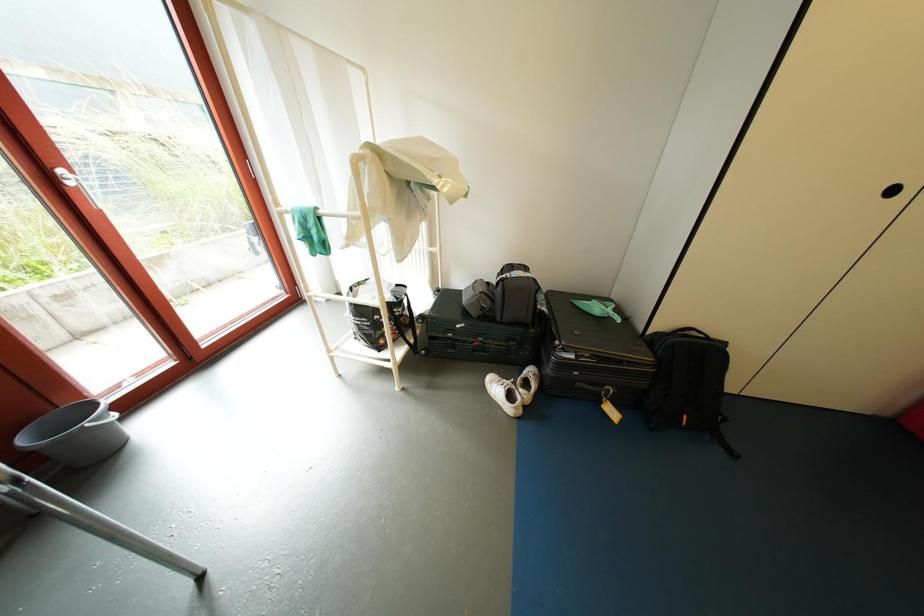
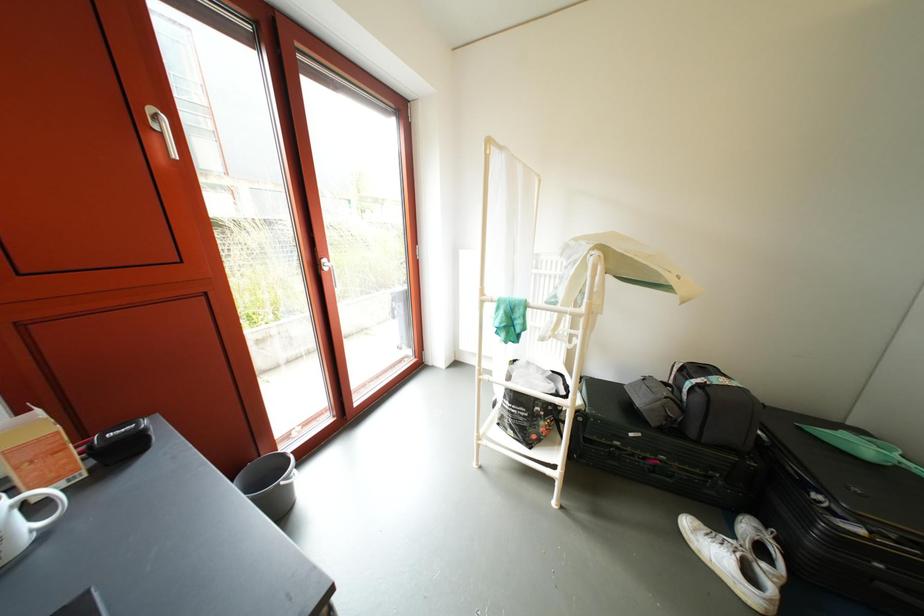
Question: The camera is either moving clockwise (left) or counter-clockwise (right) around the object. The first image is from the beginning of the video and the second image is from the end. Is the camera moving left or right when shooting the video?

Choices:
 (A) Left
 (B) Right

Answer: (B)